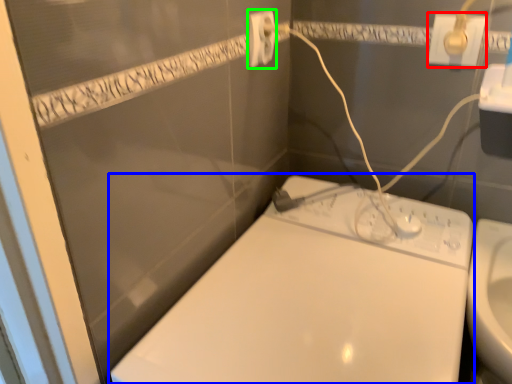
Question: Estimate the real-world distances between objects in this image. Which object is closer to power plugs and sockets (highlighted by a red box), toilet (highlighted by a blue box) or power plugs and sockets (highlighted by a green box)?

Choices:
 (A) toilet
 (B) power plugs and sockets

Answer: (B)